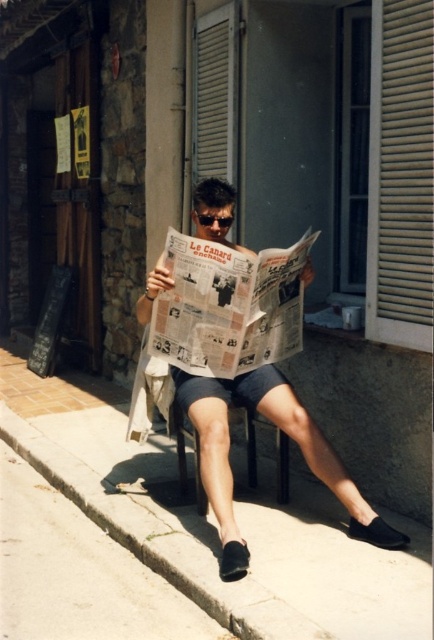
You are a delivery person who needs to place a 12 inch wide package on the ground between the concrete at lower center and the matte newspaper at center. Is there enough space for the package?

The concrete at lower center is 30.52 inches away from the matte newspaper at center. Since the package is 12 inches wide, there is enough space between the concrete at lower center and the matte newspaper at center to place the package.

Based on the photo, you are standing at the center of the image and want to place a small potted plant. Where should you place it so that it is on the concrete at lower center?

You should place the small potted plant at point [213,522] on the concrete at lower center.